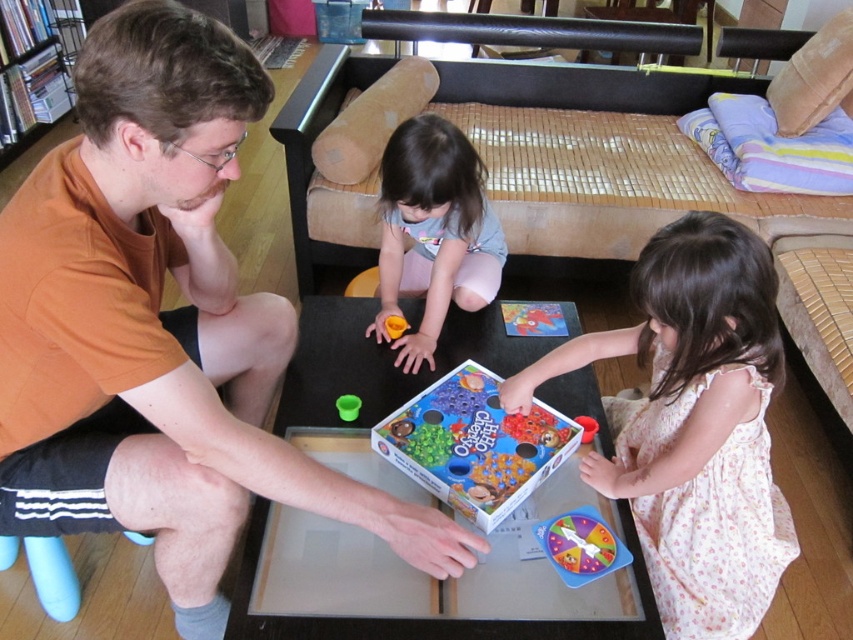
You are a delivery person who needs to place a small package on the light blue fabric pants at center without touching the metallic silver bookshelf at left. Is this possible?

The light blue fabric pants at center is shorter than the metallic silver bookshelf at left, so placing the package on the light blue fabric pants at center might be possible as long as you ensure it doesn

You are a child who wants to play with the plastic spinner at center and the green matte cup at center. Which one is larger?

The plastic spinner at center is bigger than the green matte cup at center.